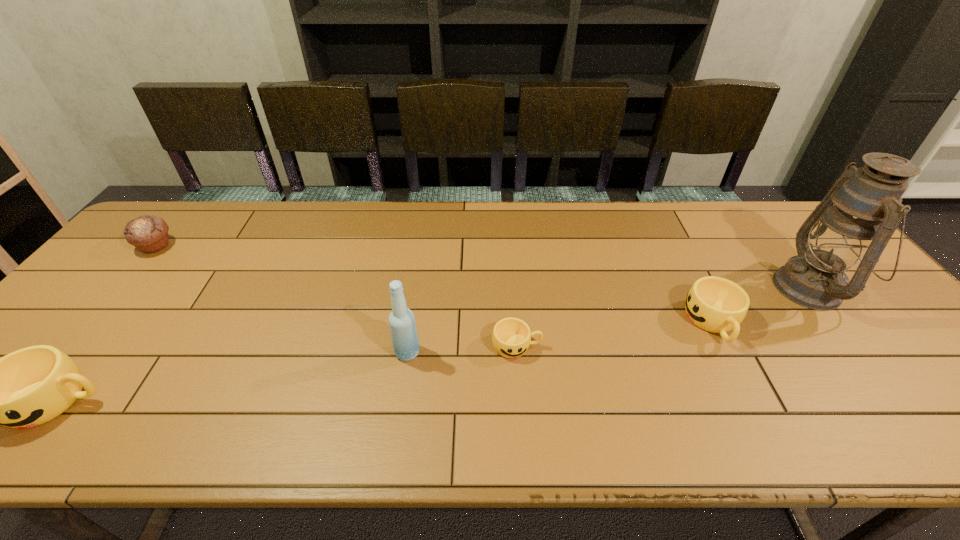
To ensure equal spacing by inserting another cup among them, please point out a vacant spot for this new cup. Please provide its 2D coordinates. Your answer should be formatted as a tuple, i.e. [(x, y)], where the tuple contains the x and y coordinates of a point satisfying the conditions above.

[(300, 372)]